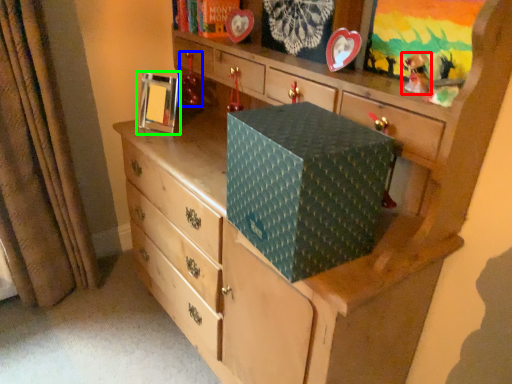
Question: Which object is the farthest from toy (highlighted by a red box)? Choose among these: toy (highlighted by a blue box) or picture frame (highlighted by a green box).

Choices:
 (A) toy
 (B) picture frame

Answer: (B)